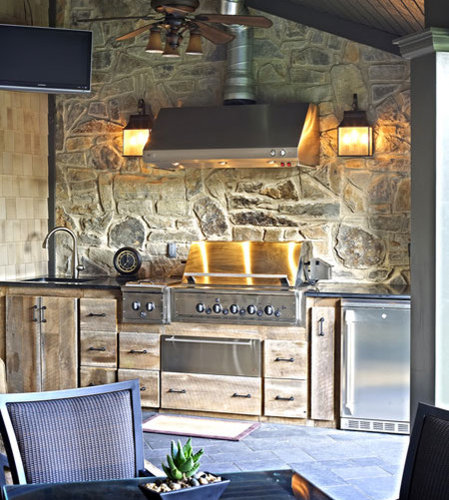
Where is `stove`? stove is located at coordinates (241, 288).